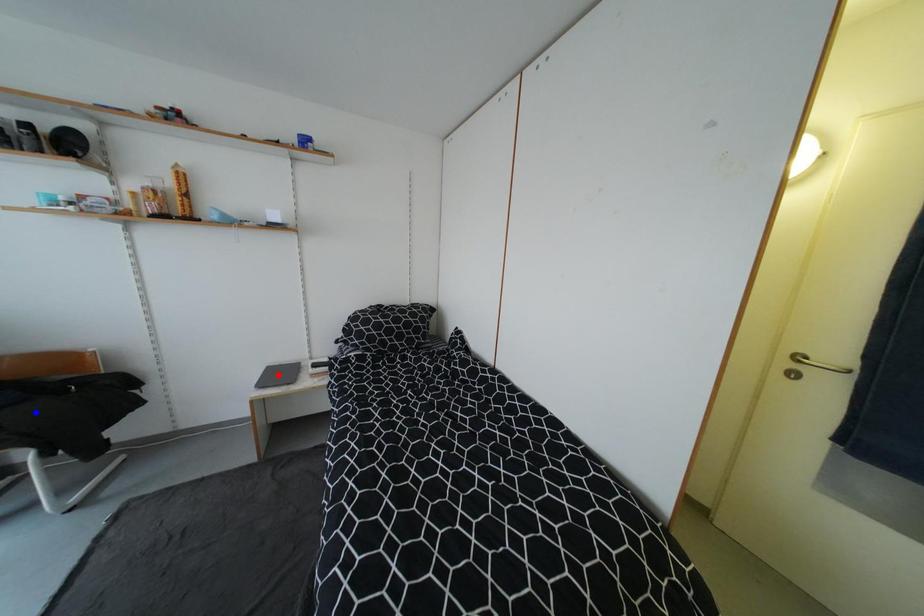
Question: Which of the two points in the image is closer to the camera?

Choices:
 (A) Blue point is closer.
 (B) Red point is closer.

Answer: (A)